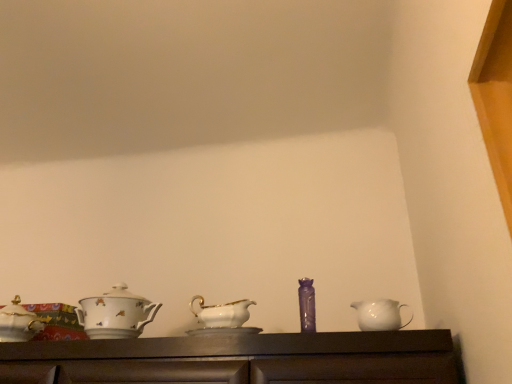
You are a GUI agent. You are given a task and a screenshot of the screen. Output one action in this format:
    pyautogui.click(x=<x>, y=<y>)
    Task: Click on the white glossy jug at right
    This screenshot has width=512, height=384.
    Given the screenshot: What is the action you would take?
    pyautogui.click(x=379, y=315)

From the image's perspective, which is above, purple glass vase at center, marked as the 1th tableware in a right-to-left arrangement, or white porcelain teapot at left, which ranks as the first tableware in left-to-right order?

purple glass vase at center, marked as the 1th tableware in a right-to-left arrangement.

Which of these two, purple glass vase at center, which appears as the 2th tableware when viewed from the left, or white porcelain teapot at left, which ranks as the first tableware in left-to-right order, stands shorter?

purple glass vase at center, which appears as the 2th tableware when viewed from the left.

Are purple glass vase at center, which appears as the 2th tableware when viewed from the left, and white porcelain teapot at left, which ranks as the first tableware in left-to-right order, far apart?

purple glass vase at center, which appears as the 2th tableware when viewed from the left, is near white porcelain teapot at left, which ranks as the first tableware in left-to-right order, not far away.

What's the angular difference between purple glass vase at center, which appears as the 2th tableware when viewed from the left, and white porcelain teapot at left, which appears as the 2th tableware when viewed from the right,'s facing directions?

purple glass vase at center, which appears as the 2th tableware when viewed from the left, and white porcelain teapot at left, which appears as the 2th tableware when viewed from the right, are facing 6.75 degrees away from each other.

Considering the sizes of objects white porcelain teapot at left, which ranks as the first tableware in left-to-right order, and white glossy jug at right in the image provided, who is smaller, white porcelain teapot at left, which ranks as the first tableware in left-to-right order, or white glossy jug at right?

With smaller size is white glossy jug at right.

Is the depth of white porcelain teapot at left, which ranks as the first tableware in left-to-right order, greater than that of white glossy jug at right?

Yes.

Does white porcelain teapot at left, which appears as the 2th tableware when viewed from the right, touch white glossy jug at right?

white porcelain teapot at left, which appears as the 2th tableware when viewed from the right, is not next to white glossy jug at right, and they're not touching.

Considering the relative sizes of white porcelain teapot at left, which appears as the 2th tableware when viewed from the right, and white glossy jug at right in the image provided, is white porcelain teapot at left, which appears as the 2th tableware when viewed from the right, shorter than white glossy jug at right?

No, white porcelain teapot at left, which appears as the 2th tableware when viewed from the right, is not shorter than white glossy jug at right.

Is white glossy jug at right closer to the viewer compared to purple glass vase at center, which appears as the 2th tableware when viewed from the left?

Yes, white glossy jug at right is in front of purple glass vase at center, which appears as the 2th tableware when viewed from the left.

Find the location of a particular element. The width and height of the screenshot is (512, 384). jug that is on the right side of purple glass vase at center, which appears as the 2th tableware when viewed from the left is located at coordinates (379, 315).

Is white glossy jug at right thinner than purple glass vase at center, which appears as the 2th tableware when viewed from the left?

No, white glossy jug at right is not thinner than purple glass vase at center, which appears as the 2th tableware when viewed from the left.

From a real-world perspective, between white glossy jug at right and purple glass vase at center, which appears as the 2th tableware when viewed from the left, who is vertically lower?

white glossy jug at right.

Is purple glass vase at center, marked as the 1th tableware in a right-to-left arrangement, not near white glossy jug at right?

They are positioned close to each other.

Which of these two, purple glass vase at center, which appears as the 2th tableware when viewed from the left, or white glossy jug at right, stands shorter?

With less height is white glossy jug at right.

Considering the sizes of objects purple glass vase at center, which appears as the 2th tableware when viewed from the left, and white glossy jug at right in the image provided, who is wider, purple glass vase at center, which appears as the 2th tableware when viewed from the left, or white glossy jug at right?

Wider between the two is white glossy jug at right.

Could you measure the distance between purple glass vase at center, which appears as the 2th tableware when viewed from the left, and white glossy jug at right?

purple glass vase at center, which appears as the 2th tableware when viewed from the left, is 6.40 inches from white glossy jug at right.

How different are the orientations of white glossy jug at right and white porcelain teapot at left, which appears as the 2th tableware when viewed from the right, in degrees?

The angular difference between white glossy jug at right and white porcelain teapot at left, which appears as the 2th tableware when viewed from the right, is 6.75 degrees.

Considering the positions of points (390, 306) and (140, 314), is point (390, 306) closer to camera compared to point (140, 314)?

Yes, point (390, 306) is in front of point (140, 314).

Who is taller, white glossy jug at right or white porcelain teapot at left, which ranks as the first tableware in left-to-right order?

white porcelain teapot at left, which ranks as the first tableware in left-to-right order, is taller.

Which of these two, white porcelain teapot at left, which appears as the 2th tableware when viewed from the right, or purple glass vase at center, marked as the 1th tableware in a right-to-left arrangement, stands taller?

Standing taller between the two is white porcelain teapot at left, which appears as the 2th tableware when viewed from the right.

Does white porcelain teapot at left, which appears as the 2th tableware when viewed from the right, turn towards purple glass vase at center, marked as the 1th tableware in a right-to-left arrangement?

No, white porcelain teapot at left, which appears as the 2th tableware when viewed from the right, is not aimed at purple glass vase at center, marked as the 1th tableware in a right-to-left arrangement.

Is white porcelain teapot at left, which appears as the 2th tableware when viewed from the right, completely or partially outside of purple glass vase at center, which appears as the 2th tableware when viewed from the left?

Indeed, white porcelain teapot at left, which appears as the 2th tableware when viewed from the right, is completely outside purple glass vase at center, which appears as the 2th tableware when viewed from the left.

From a real-world perspective, who is located higher, white porcelain teapot at left, which ranks as the first tableware in left-to-right order, or purple glass vase at center, which appears as the 2th tableware when viewed from the left?

white porcelain teapot at left, which ranks as the first tableware in left-to-right order.

The image size is (512, 384). What are the coordinates of `tableware located underneath the white porcelain teapot at left, which ranks as the first tableware in left-to-right order (from a real-world perspective)` in the screenshot? It's located at (307, 305).

The image size is (512, 384). What are the coordinates of `the 2nd tableware counting from the left of the white glossy jug at right` in the screenshot? It's located at (116, 314).

Looking at the image, which one is located further to white porcelain teapot at left, which appears as the 2th tableware when viewed from the right, purple glass vase at center, marked as the 1th tableware in a right-to-left arrangement, or white glossy jug at right?

white glossy jug at right is further to white porcelain teapot at left, which appears as the 2th tableware when viewed from the right.

Looking at the image, which one is located further to white glossy jug at right, purple glass vase at center, which appears as the 2th tableware when viewed from the left, or white porcelain teapot at left, which appears as the 2th tableware when viewed from the right?

Among the two, white porcelain teapot at left, which appears as the 2th tableware when viewed from the right, is located further to white glossy jug at right.

From the image, which object appears to be nearer to purple glass vase at center, which appears as the 2th tableware when viewed from the left, white porcelain teapot at left, which ranks as the first tableware in left-to-right order, or white glossy jug at right?

white glossy jug at right.

Considering their positions, is white glossy jug at right positioned further to purple glass vase at center, which appears as the 2th tableware when viewed from the left, than white porcelain teapot at left, which appears as the 2th tableware when viewed from the right?

white porcelain teapot at left, which appears as the 2th tableware when viewed from the right, lies further to purple glass vase at center, which appears as the 2th tableware when viewed from the left, than the other object.

Estimate the real-world distances between objects in this image. Which object is closer to white porcelain teapot at left, which appears as the 2th tableware when viewed from the right, white glossy jug at right or purple glass vase at center, marked as the 1th tableware in a right-to-left arrangement?

Among the two, purple glass vase at center, marked as the 1th tableware in a right-to-left arrangement, is located nearer to white porcelain teapot at left, which appears as the 2th tableware when viewed from the right.

When comparing their distances from white glossy jug at right, does white porcelain teapot at left, which appears as the 2th tableware when viewed from the right, or purple glass vase at center, which appears as the 2th tableware when viewed from the left, seem further?

white porcelain teapot at left, which appears as the 2th tableware when viewed from the right, is further to white glossy jug at right.

You are a GUI agent. You are given a task and a screenshot of the screen. Output one action in this format:
    pyautogui.click(x=<x>, y=<y>)
    Task: Click on the tableware situated between white porcelain teapot at left, which ranks as the first tableware in left-to-right order, and white glossy jug at right from left to right
    The image size is (512, 384).
    Given the screenshot: What is the action you would take?
    pyautogui.click(x=307, y=305)